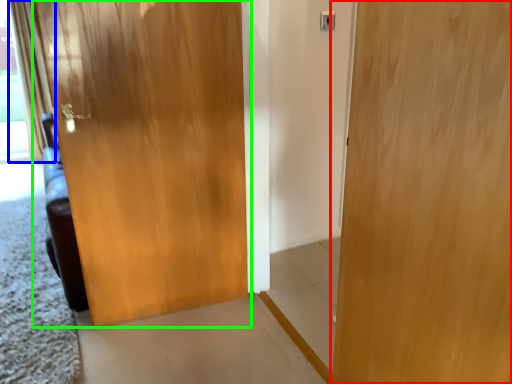
Question: Which object is positioned closest to door (highlighted by a red box)? Select from curtain (highlighted by a blue box) and door (highlighted by a green box).

Choices:
 (A) curtain
 (B) door

Answer: (B)